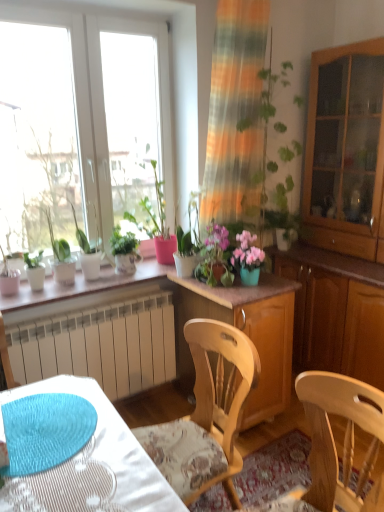
Where is `vacant region in front of pink matte floral arrangement at center`? vacant region in front of pink matte floral arrangement at center is located at coordinates (236, 293).